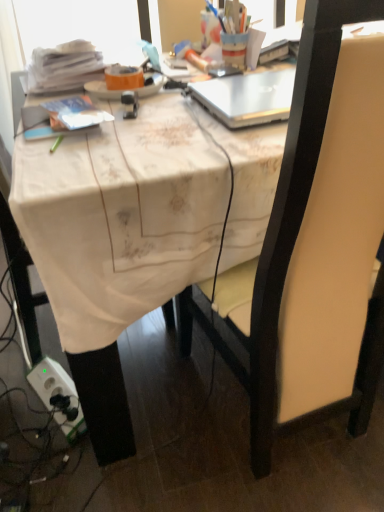
Question: Is matte black chair at center outside orange matte plate at upper center?

Choices:
 (A) no
 (B) yes

Answer: (B)

Question: Can you confirm if matte black chair at center is positioned to the left of orange matte plate at upper center?

Choices:
 (A) no
 (B) yes

Answer: (A)

Question: Is matte black chair at center far from orange matte plate at upper center?

Choices:
 (A) no
 (B) yes

Answer: (A)

Question: Is matte black chair at center smaller than orange matte plate at upper center?

Choices:
 (A) no
 (B) yes

Answer: (A)

Question: Considering the relative positions of matte black chair at center and orange matte plate at upper center in the image provided, is matte black chair at center behind orange matte plate at upper center?

Choices:
 (A) yes
 (B) no

Answer: (B)

Question: Could you tell me if matte black chair at center is facing orange matte plate at upper center?

Choices:
 (A) no
 (B) yes

Answer: (A)

Question: Is white fabric-covered desk at center facing towards orange matte plate at upper center?

Choices:
 (A) no
 (B) yes

Answer: (A)

Question: Is white fabric-covered desk at center thinner than orange matte plate at upper center?

Choices:
 (A) yes
 (B) no

Answer: (B)

Question: Are white fabric-covered desk at center and orange matte plate at upper center located far from each other?

Choices:
 (A) yes
 (B) no

Answer: (B)

Question: From a real-world perspective, does white fabric-covered desk at center sit lower than orange matte plate at upper center?

Choices:
 (A) no
 (B) yes

Answer: (B)

Question: Is white fabric-covered desk at center not within orange matte plate at upper center?

Choices:
 (A) no
 (B) yes

Answer: (B)

Question: From the image's perspective, does white fabric-covered desk at center appear lower than orange matte plate at upper center?

Choices:
 (A) yes
 (B) no

Answer: (A)

Question: Would you say white fabric-covered desk at center contains silver metallic laptop at upper center?

Choices:
 (A) yes
 (B) no

Answer: (B)